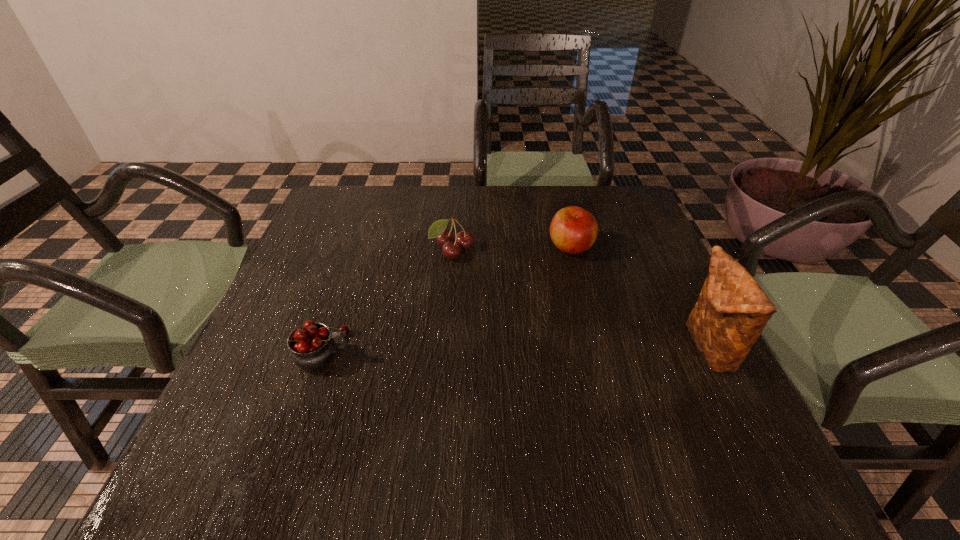
Image resolution: width=960 pixels, height=540 pixels. I want to click on the leftmost object, so click(312, 346).

Identify the location of the taller cherry. The image size is (960, 540). [x=312, y=346].

I want to click on the rightmost object, so click(732, 310).

The height and width of the screenshot is (540, 960). In order to click on clutch bag in this screenshot , I will do `click(732, 310)`.

At what (x,y) coordinates should I click in order to perform the action: click on the shorter cherry. Please return your answer as a coordinate pair (x, y). The width and height of the screenshot is (960, 540). Looking at the image, I should click on (463, 240).

Identify the location of the second object from left to right. (463, 240).

The height and width of the screenshot is (540, 960). What are the coordinates of `apple` in the screenshot? It's located at (573, 230).

Image resolution: width=960 pixels, height=540 pixels. Identify the location of vacant space located on the handle side of the left cherry. (496, 350).

The height and width of the screenshot is (540, 960). What are the coordinates of `blank area located 0.220m on the open side of the rightmost object` in the screenshot? It's located at (578, 348).

Image resolution: width=960 pixels, height=540 pixels. In order to click on vacant area situated 0.320m on the open side of the rightmost object in this screenshot , I will do `click(527, 348)`.